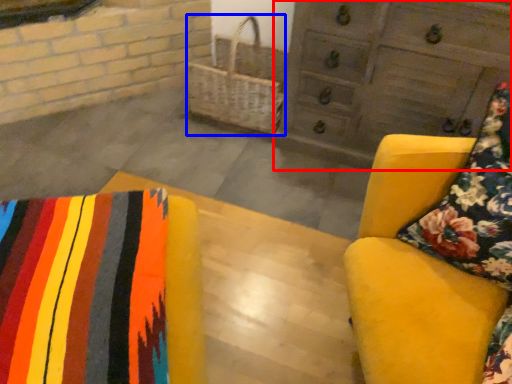
Question: Among these objects, which one is nearest to the camera, chest of drawers (highlighted by a red box) or basket (highlighted by a blue box)?

Choices:
 (A) chest of drawers
 (B) basket

Answer: (A)